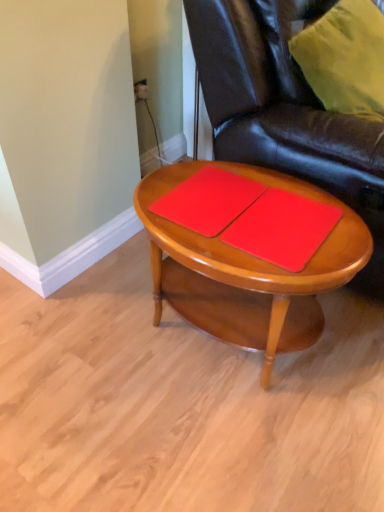
At what (x,y) coordinates should I click in order to perform the action: click on free space above red matte notebook at center, acting as the 2th notebook starting from the left (from a real-world perspective). Please return your answer as a coordinate pair (x, y). The image size is (384, 512). Looking at the image, I should click on (278, 220).